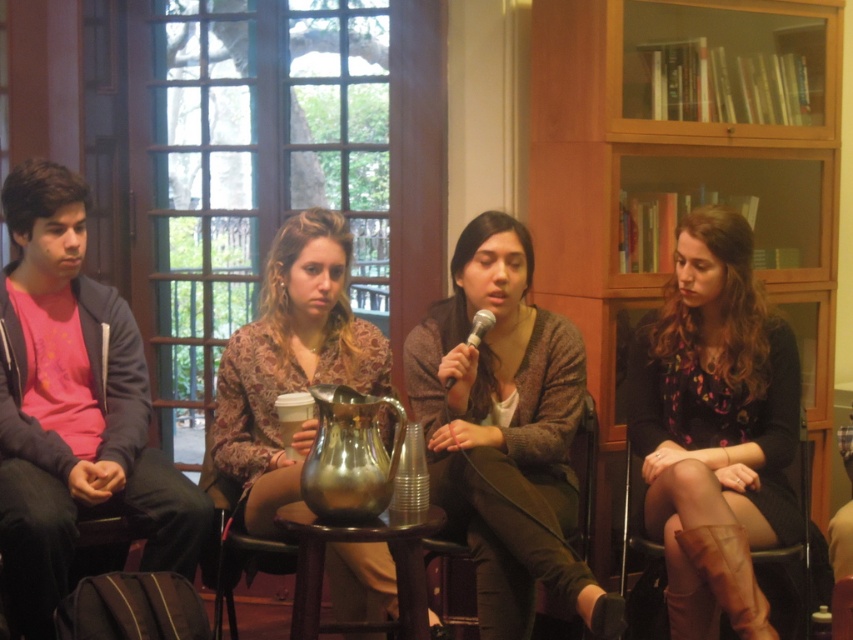
Is shiny metallic pitcher at center bigger than metallic silver microphone at center?

Correct, shiny metallic pitcher at center is larger in size than metallic silver microphone at center.

Is shiny metallic pitcher at center in front of metallic silver microphone at center?

That is True.

Is point (289, 282) positioned behind point (450, 380)?

Yes.

The height and width of the screenshot is (640, 853). I want to click on shiny metallic pitcher at center, so click(x=289, y=364).

Is point (476, 589) behind point (550, 554)?

That is True.

Identify the location of knit sweater at center. coord(505,432).

Is point (520, 493) farther from camera compared to point (489, 628)?

Yes, point (520, 493) is farther from viewer.

The height and width of the screenshot is (640, 853). Find the location of `knit sweater at center`. knit sweater at center is located at coordinates (505, 432).

Can you confirm if wooden chair at center is positioned below leather at right?

No.

Is wooden chair at center taller than leather at right?

In fact, wooden chair at center may be shorter than leather at right.

Is point (474, 493) less distant than point (625, 518)?

That is True.

Locate an element on the screen. The width and height of the screenshot is (853, 640). wooden chair at center is located at coordinates (509, 532).